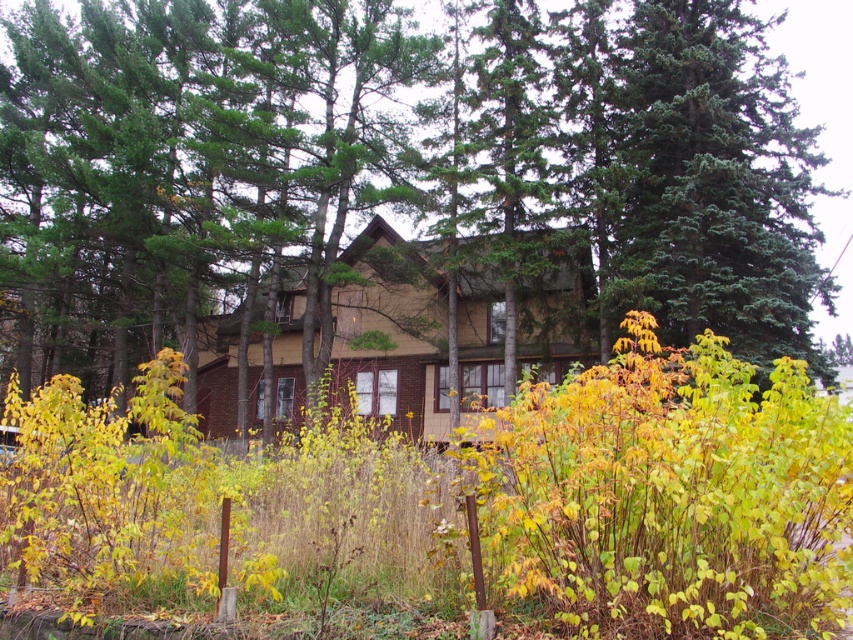
Question: Which of the following is the farthest from the observer?

Choices:
 (A) green textured tree at center
 (B) yellow-green leafy bush at center

Answer: (A)

Question: Is green textured tree at center below yellow-green leafy bush at center?

Choices:
 (A) yes
 (B) no

Answer: (B)

Question: Does green textured tree at center lie behind yellow-green leafy bush at center?

Choices:
 (A) no
 (B) yes

Answer: (B)

Question: Does green textured tree at center come behind yellow-green leafy bush at center?

Choices:
 (A) yes
 (B) no

Answer: (A)

Question: Which point appears closest to the camera in this image?

Choices:
 (A) (258, 166)
 (B) (764, 540)

Answer: (B)